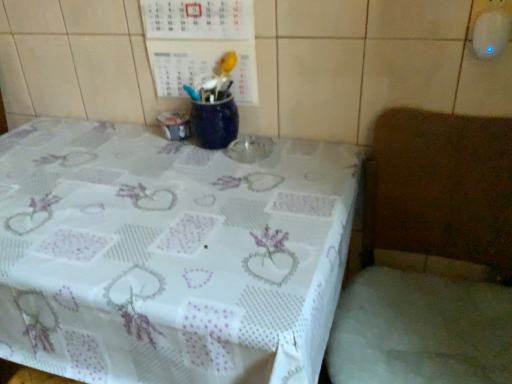
Question: Is white lace tablecloth at center at the back of wooden chair at right?

Choices:
 (A) no
 (B) yes

Answer: (A)

Question: Is wooden chair at right shorter than white lace tablecloth at center?

Choices:
 (A) yes
 (B) no

Answer: (B)

Question: From a real-world perspective, is wooden chair at right physically above white lace tablecloth at center?

Choices:
 (A) yes
 (B) no

Answer: (A)

Question: From the image's perspective, is wooden chair at right on white lace tablecloth at center?

Choices:
 (A) yes
 (B) no

Answer: (B)

Question: From the image's perspective, would you say wooden chair at right is shown under white lace tablecloth at center?

Choices:
 (A) yes
 (B) no

Answer: (A)

Question: Can you confirm if wooden chair at right is wider than white lace tablecloth at center?

Choices:
 (A) no
 (B) yes

Answer: (A)

Question: Can you confirm if wooden chair at right is bigger than white lace tablecloth at lower right?

Choices:
 (A) yes
 (B) no

Answer: (A)

Question: Does wooden chair at right lie in front of white lace tablecloth at lower right?

Choices:
 (A) no
 (B) yes

Answer: (B)

Question: From the image's perspective, would you say wooden chair at right is shown under white lace tablecloth at lower right?

Choices:
 (A) no
 (B) yes

Answer: (B)

Question: From the image's perspective, would you say wooden chair at right is positioned over white lace tablecloth at lower right?

Choices:
 (A) yes
 (B) no

Answer: (B)

Question: Is there a large distance between wooden chair at right and white lace tablecloth at lower right?

Choices:
 (A) no
 (B) yes

Answer: (A)

Question: Does wooden chair at right lie behind white lace tablecloth at lower right?

Choices:
 (A) yes
 (B) no

Answer: (B)

Question: From the image's perspective, is white lace tablecloth at lower right over white lace tablecloth at center?

Choices:
 (A) yes
 (B) no

Answer: (A)